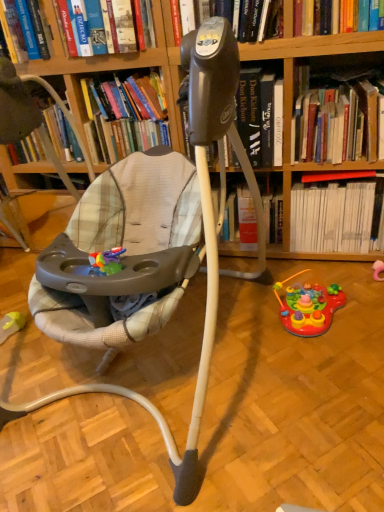
You are a GUI agent. You are given a task and a screenshot of the screen. Output one action in this format:
    pyautogui.click(x=<x>, y=<y>)
    Task: Click on the unoccupied area in front of rubber yellow toy at lower left, which is the 3th toy from right to left
    The image size is (384, 512).
    Given the screenshot: What is the action you would take?
    pyautogui.click(x=22, y=366)